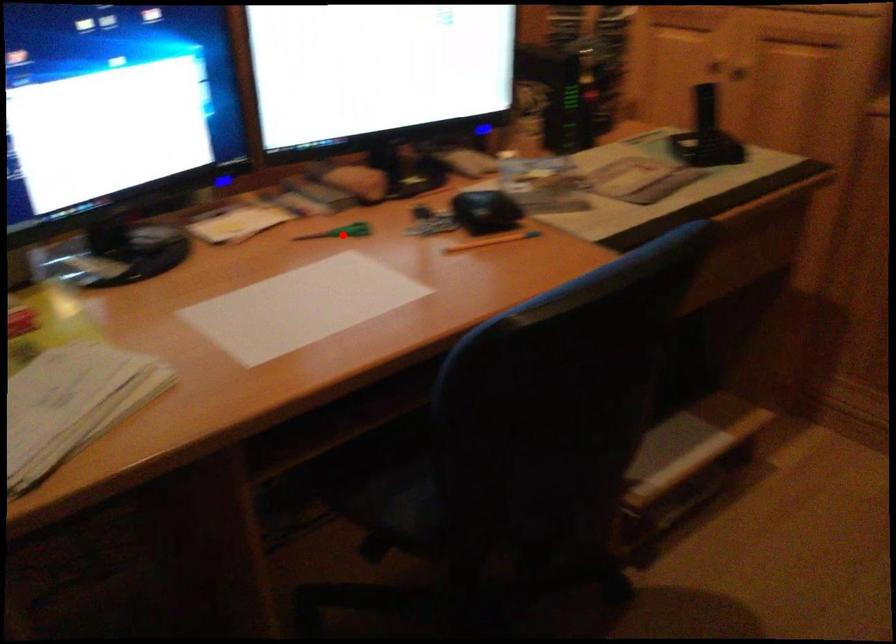
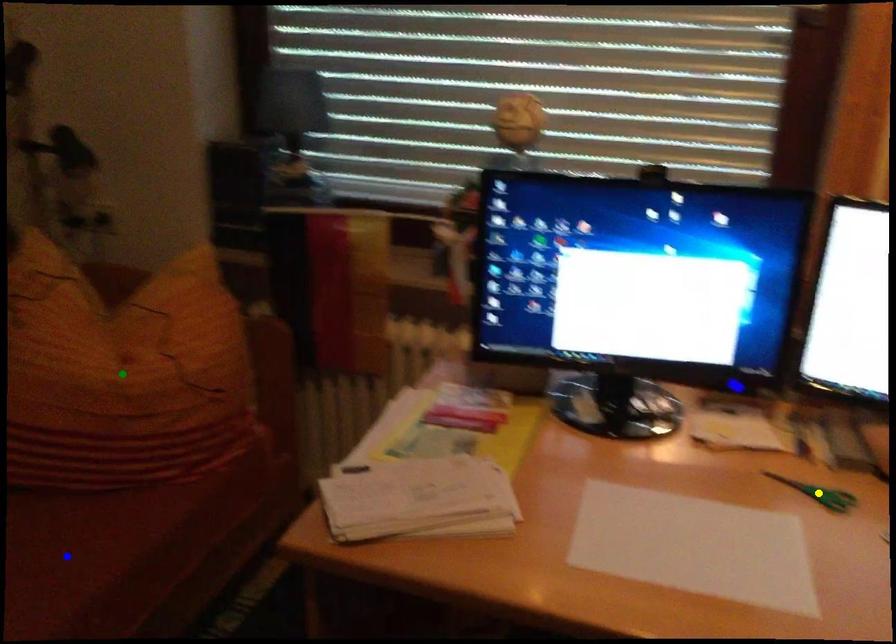
Question: I am providing you with two images of the same scene from different viewpoints. A red point is marked on the first image. You are given multiple points on the second image. Which mark in image 2 goes with the point in image 1?

Choices:
 (A) green point
 (B) yellow point
 (C) blue point

Answer: (B)